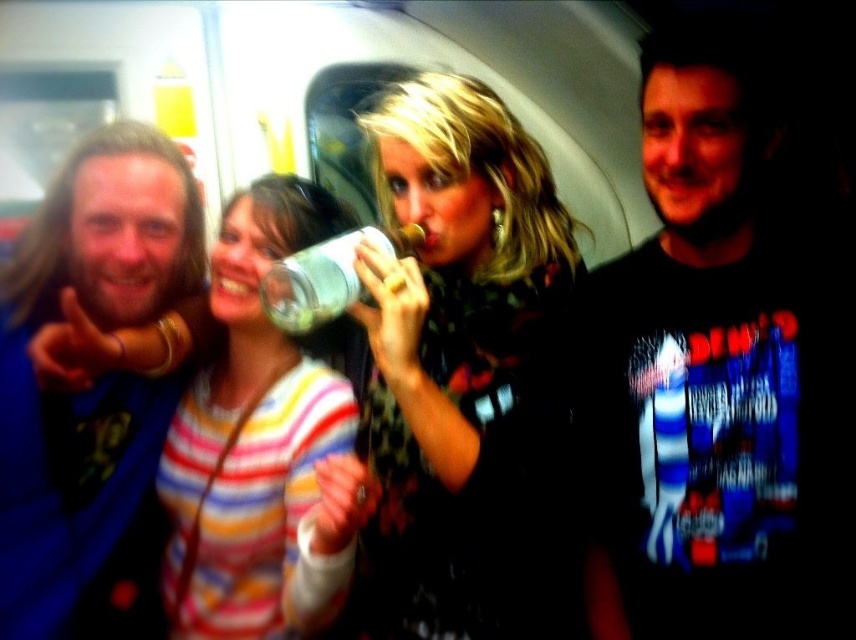
You are a photographer trying to capture a candid shot of the long hair man at left and the transparent plastic bottle at center in the subway car. The camera has a depth of field that can focus on objects within 12 inches of each other. Will both subjects be in focus?

The long hair man at left and transparent plastic bottle at center are 14.11 inches apart from each other, which exceeds the camera depth of field limit of 12 inches. Therefore, both subjects cannot be in focus simultaneously.

You are standing in the subway car and want to take a photo of the long hair man at left. Where should you position yourself to capture him in the frame?

To capture the long hair man at left in the frame, position yourself so that the camera is aimed at the coordinates corresponding to his 2D location at point (91, 388).